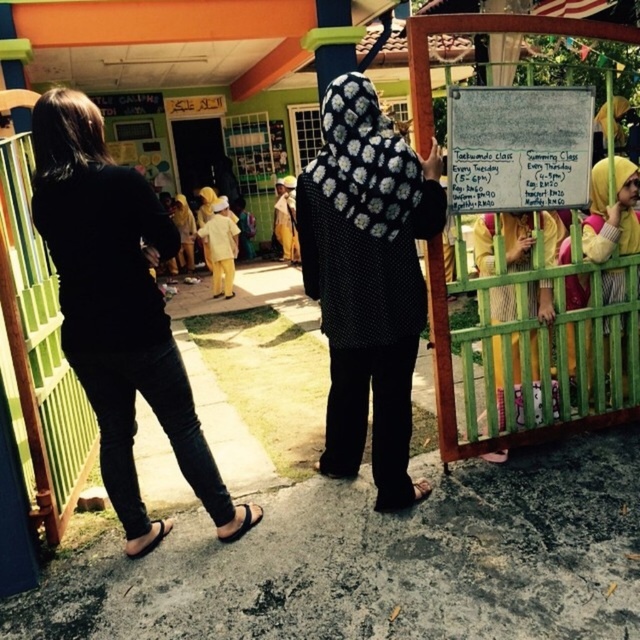
Can you confirm if black matte pants at lower left is positioned to the right of yellow fabric headscarf at right?

Incorrect, black matte pants at lower left is not on the right side of yellow fabric headscarf at right.

Based on the photo, how distant is black matte pants at lower left from yellow fabric headscarf at right?

black matte pants at lower left and yellow fabric headscarf at right are 2.28 meters apart from each other.

Describe the element at coordinates (118, 310) in the screenshot. Image resolution: width=640 pixels, height=640 pixels. I see `black matte pants at lower left` at that location.

Find the location of a particular element. The height and width of the screenshot is (640, 640). black matte pants at lower left is located at coordinates (118, 310).

Measure the distance between black matte pants at lower left and yellow fabric hijab at center.

A distance of 8.82 meters exists between black matte pants at lower left and yellow fabric hijab at center.

The height and width of the screenshot is (640, 640). What do you see at coordinates (118, 310) in the screenshot? I see `black matte pants at lower left` at bounding box center [118, 310].

Locate an element on the screen. black matte pants at lower left is located at coordinates (118, 310).

Does dry erase board at upper center appear on the right side of yellow fabric hijab at upper right?

No, dry erase board at upper center is not to the right of yellow fabric hijab at upper right.

How distant is dry erase board at upper center from yellow fabric hijab at upper right?

dry erase board at upper center is 45.08 centimeters away from yellow fabric hijab at upper right.

Find the location of a particular element. dry erase board at upper center is located at coordinates (518, 147).